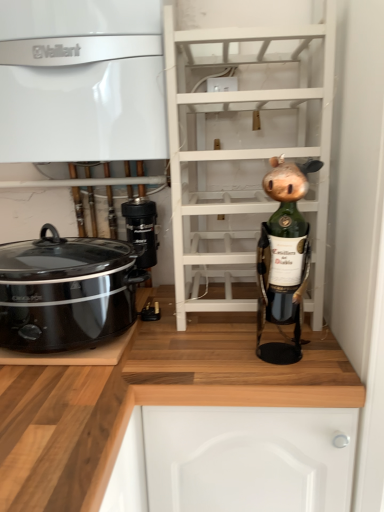
Locate an element on the screen. This screenshot has width=384, height=512. vacant space in between white wooden shelf at center and green matte wine bottle at right is located at coordinates (249, 346).